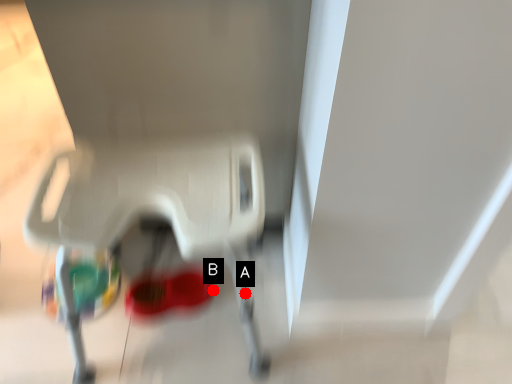
Question: Two points are circled on the image, labeled by A and B beside each circle. Which point is further to the camera?

Choices:
 (A) A is further
 (B) B is further

Answer: (B)